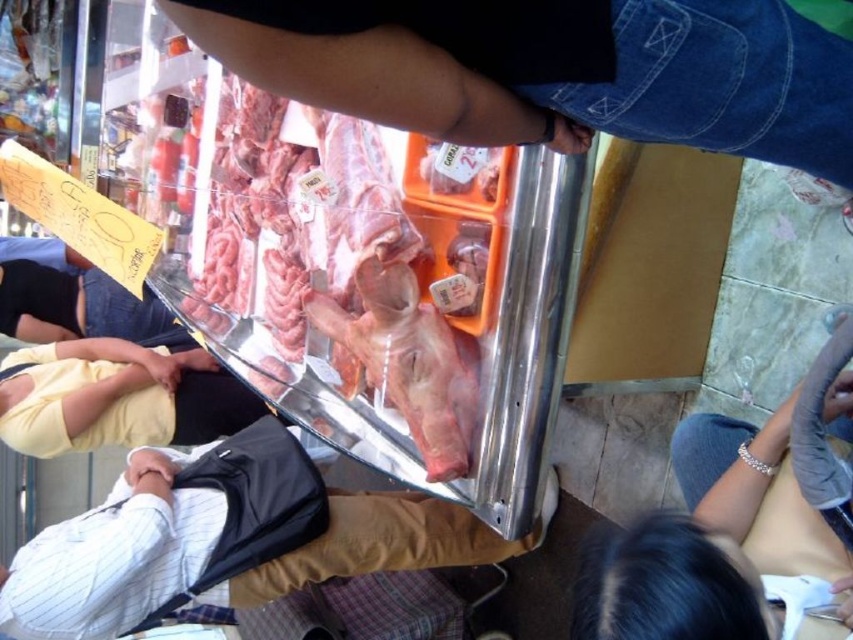
You are a customer in the butcher shop and want to see both the white striped shirt at lower left and the yellow cotton shirt at lower left. Which shirt should you look under to find the other one?

The white striped shirt at lower left is positioned under the yellow cotton shirt at lower left, so to find the white striped shirt at lower left, you should look under the yellow cotton shirt at lower left.

You are a customer in the butcher shop and you want to see the price tags on the meats behind the shirts. Which shirt, the white striped shirt at lower left or the yellow cotton shirt at lower left, is blocking more of your view?

The white striped shirt at lower left is blocking more of your view because it has a greater height compared to the yellow cotton shirt at lower left.